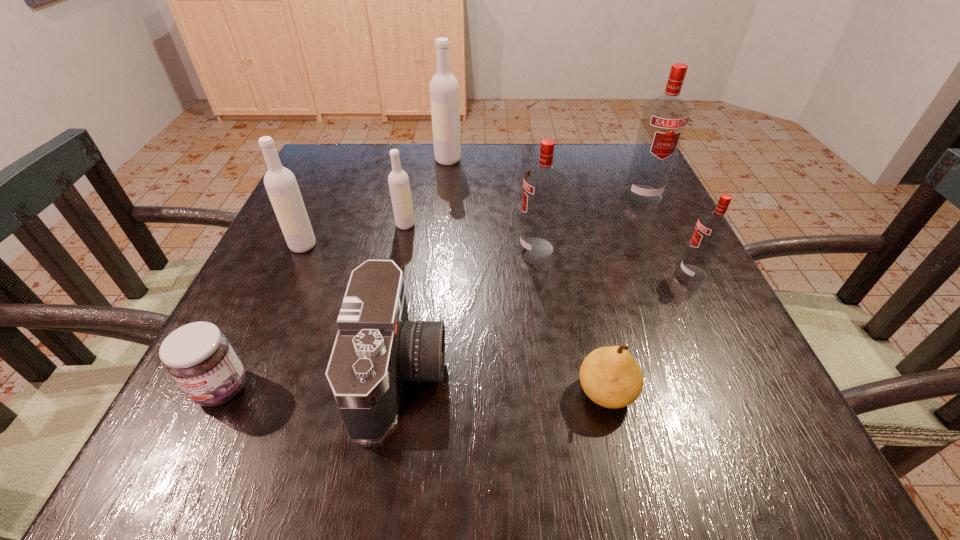
Find the location of a particular element. This screenshot has width=960, height=540. free point located 0.050m on the back of the second smallest white vodka is located at coordinates (313, 222).

Identify the location of vacant space located 0.150m on the front label of the nearest red vodka. (601, 274).

What are the coordinates of `vacant space located 0.170m on the front label of the nearest red vodka` in the screenshot? It's located at (591, 274).

Find the location of a particular element. vacant space located on the front label of the nearest red vodka is located at coordinates (616, 274).

The image size is (960, 540). What are the coordinates of `free space located 0.140m on the back of the second farthest white vodka` in the screenshot? It's located at (413, 185).

Locate an element on the screen. This screenshot has height=540, width=960. blank space located on the front-facing side of the black camera is located at coordinates (528, 373).

Identify the location of blank space located 0.320m on the left of the pear. The height and width of the screenshot is (540, 960). pos(367,393).

At what (x,y) coordinates should I click in order to perform the action: click on free space located on the front label of the jam. Please return your answer as a coordinate pair (x, y). This screenshot has height=540, width=960. Looking at the image, I should click on (188, 460).

Where is `camera present at the near edge`? This screenshot has height=540, width=960. camera present at the near edge is located at coordinates (377, 348).

Locate an element on the screen. This screenshot has width=960, height=540. pear positioned at the near edge is located at coordinates (610, 376).